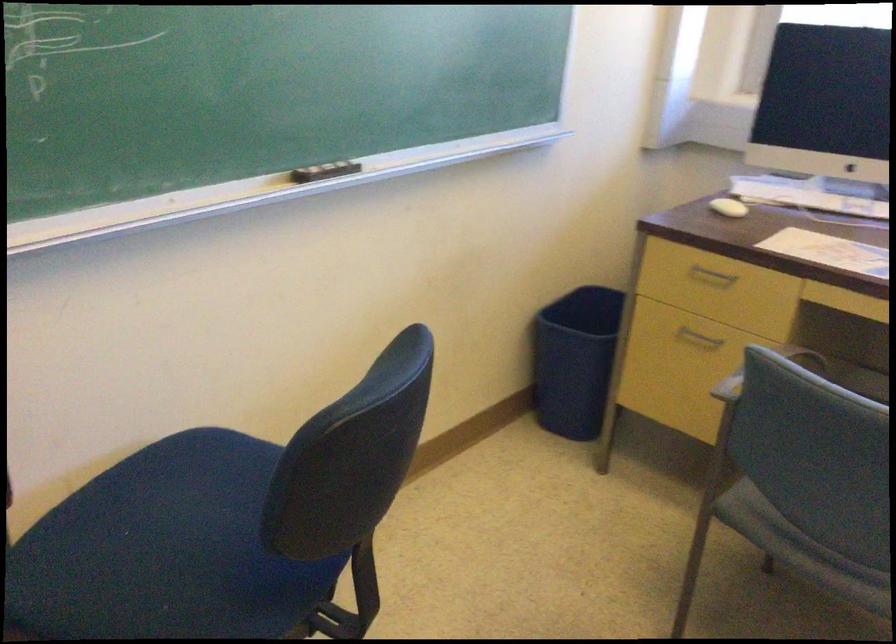
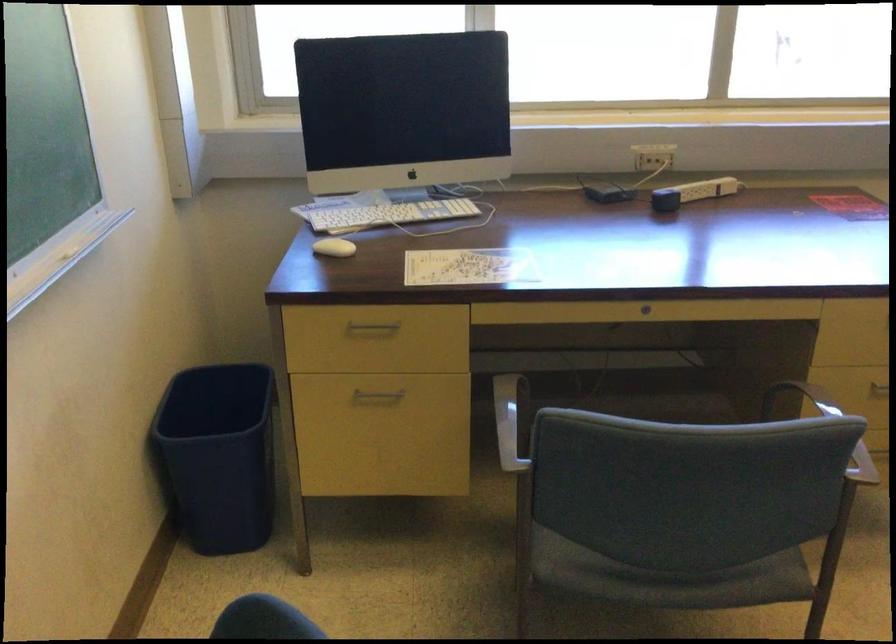
The point at [764,371] is marked in the first image. Where is the corresponding point in the second image?

(511, 421)